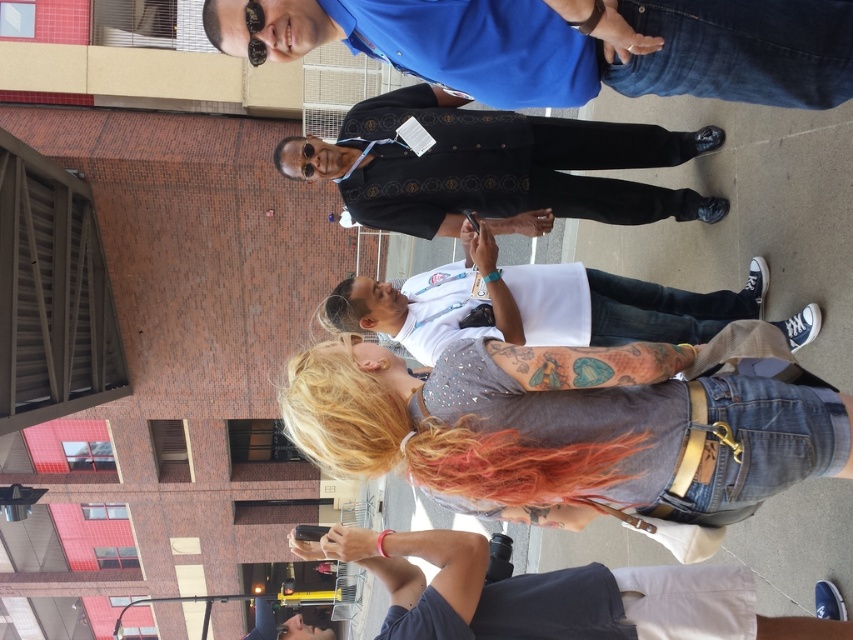
Is matte black shirt at center smaller than dark gray cotton t-shirt at lower center?

Incorrect, matte black shirt at center is not smaller in size than dark gray cotton t-shirt at lower center.

Is matte black shirt at center positioned before dark gray cotton t-shirt at lower center?

No, it is behind dark gray cotton t-shirt at lower center.

Which is behind, point (613, 160) or point (457, 611)?

The point (613, 160) is behind.

You are a GUI agent. You are given a task and a screenshot of the screen. Output one action in this format:
    pyautogui.click(x=<x>, y=<y>)
    Task: Click on the matte black shirt at center
    
    Given the screenshot: What is the action you would take?
    pyautogui.click(x=494, y=166)

Can you confirm if gray studded shirt at center is positioned below dark gray cotton t-shirt at lower center?

Incorrect, gray studded shirt at center is not positioned below dark gray cotton t-shirt at lower center.

Who is more distant from viewer, (486, 500) or (480, 625)?

The point (486, 500) is more distant.

Find the location of a particular element. This screenshot has height=640, width=853. gray studded shirt at center is located at coordinates (561, 428).

Is gray t-shirt at center smaller than dark gray cotton t-shirt at lower center?

No, gray t-shirt at center is not smaller than dark gray cotton t-shirt at lower center.

Does gray t-shirt at center have a greater width compared to dark gray cotton t-shirt at lower center?

Yes, gray t-shirt at center is wider than dark gray cotton t-shirt at lower center.

Is point (732, 292) closer to viewer compared to point (450, 604)?

No, it is not.

Identify the location of gray t-shirt at center. (532, 305).